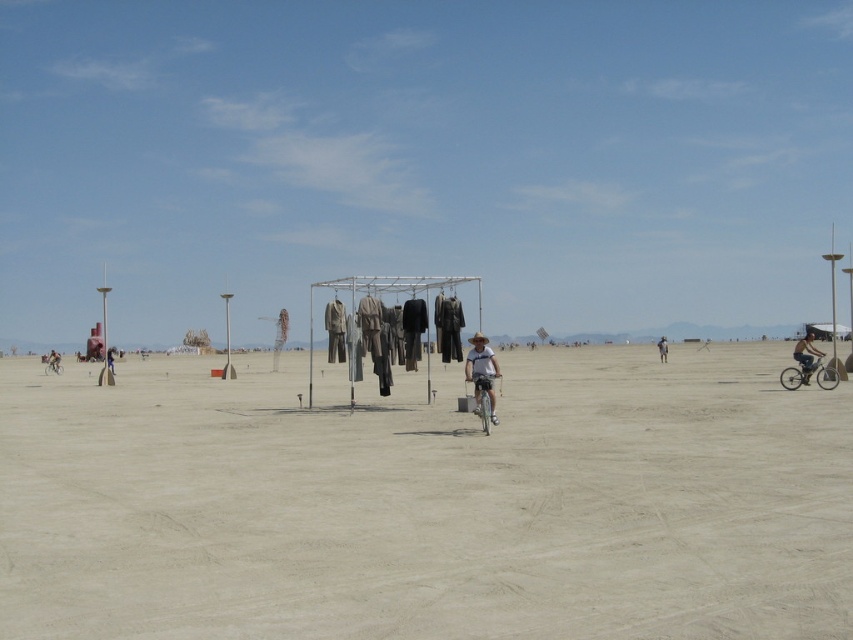
Which of these two, silver metallic bicycle at right or silver metallic bicycle at center, stands taller?

With more height is silver metallic bicycle at center.

Who is more distant from viewer, (793, 378) or (479, 408)?

Positioned behind is point (793, 378).

Measure the distance between silver metallic bicycle at right and camera.

silver metallic bicycle at right is 30.07 meters away from camera.

At what (x,y) coordinates should I click in order to perform the action: click on silver metallic bicycle at right. Please return your answer as a coordinate pair (x, y). This screenshot has height=640, width=853. Looking at the image, I should click on (808, 372).

Between matte black bicycle at center and brown fabric at center, which one has less height?

brown fabric at center is shorter.

Is matte black bicycle at center to the right of brown fabric at center from the viewer's perspective?

Incorrect, matte black bicycle at center is not on the right side of brown fabric at center.

Who is more distant from viewer, (51,353) or (662,340)?

Point (51,353)

I want to click on matte black bicycle at center, so click(x=53, y=362).

Consider the image. Does silver metallic bicycle at right lie behind matte black bicycle at right?

Yes, silver metallic bicycle at right is behind matte black bicycle at right.

Between point (819, 356) and point (798, 353), which one is positioned in front?

Point (798, 353)

The height and width of the screenshot is (640, 853). I want to click on silver metallic bicycle at right, so click(808, 372).